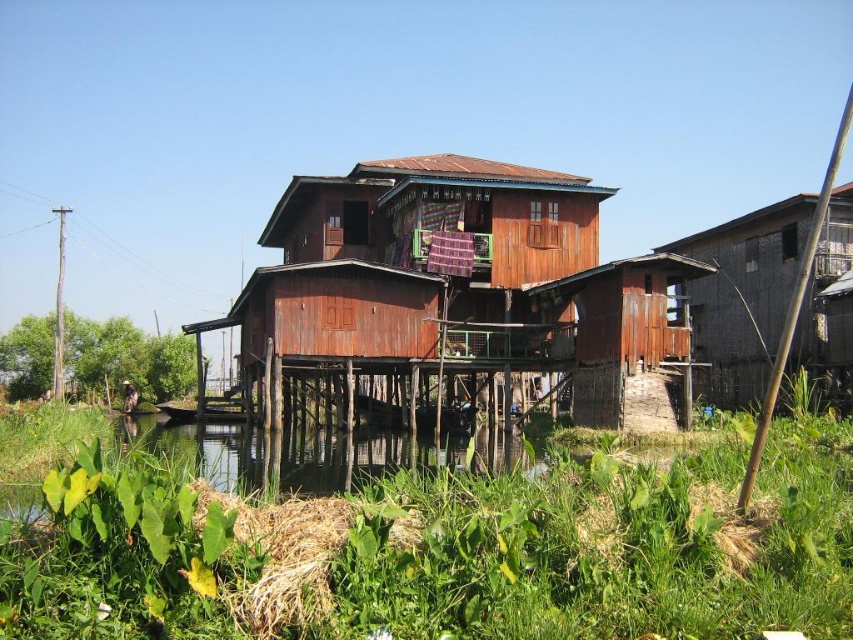
You are standing on the wooden dock at the edge of the green grassy river at lower left. You want to reach the rusty wood house at center. Which direction should you go to get there?

The rusty wood house at center is positioned over the green grassy river at lower left, so you should head towards the center from your current position on the dock to reach it.

You are a delivery drone carrying a package that requires a landing zone at least 5 meters away from the green grassy river at lower left. You need to land near the rusty wood house at center. Can you safely land there?

The distance between the rusty wood house at center and the green grassy river at lower left is 5.64 meters, which is more than the required 5 meters. Therefore, you can safely land near the rusty wood house at center.

You are standing on the wooden hut at right and want to look down to see the green grassy river at lower left. In which direction should you look?

You should look downward because the wooden hut at right is above the green grassy river at lower left.